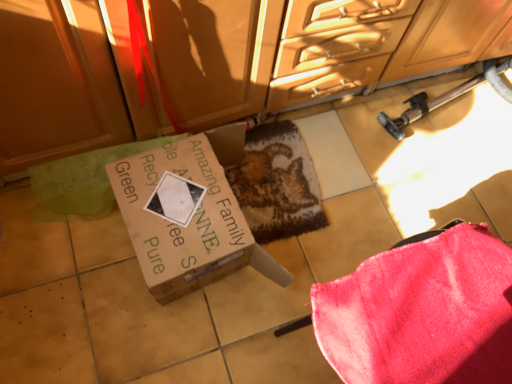
Locate an element on the screen. The width and height of the screenshot is (512, 384). vacant space in front of brown cardboard box at center is located at coordinates (157, 344).